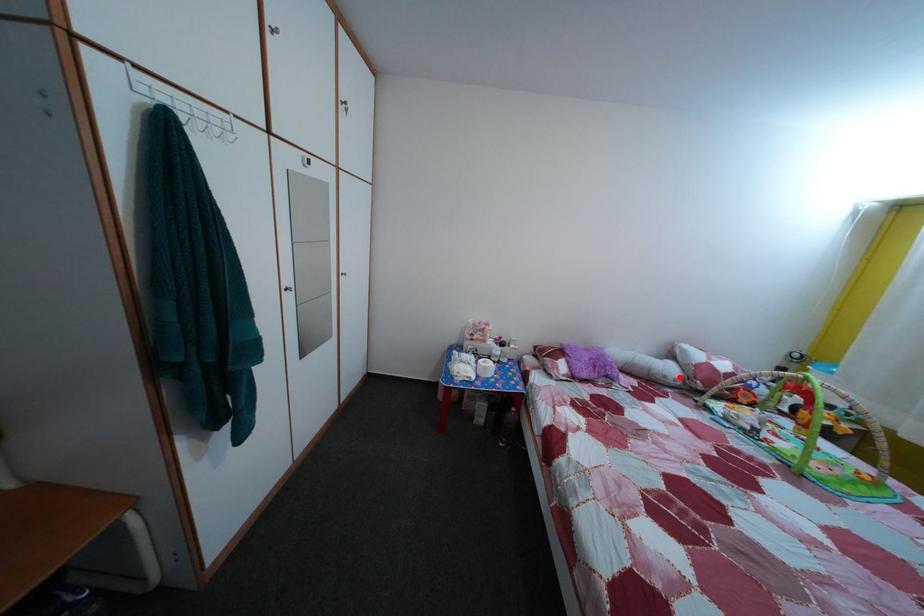
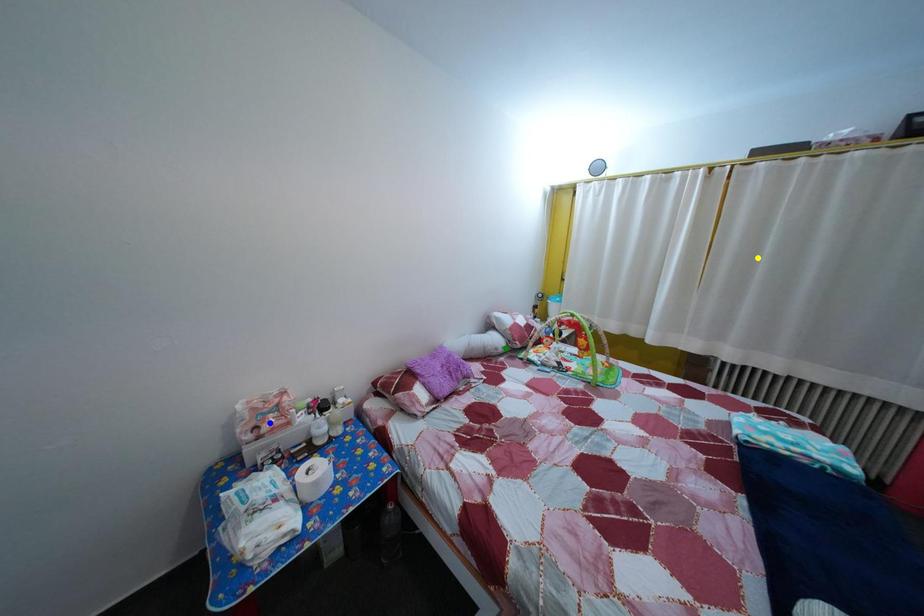
Question: I am providing you with two images of the same scene from different viewpoints. A red point is marked on the first image. You are given multiple points on the second image. Which point in image 2 represents the same 3d spot as the red point in image 1?

Choices:
 (A) green point
 (B) yellow point
 (C) blue point

Answer: (A)